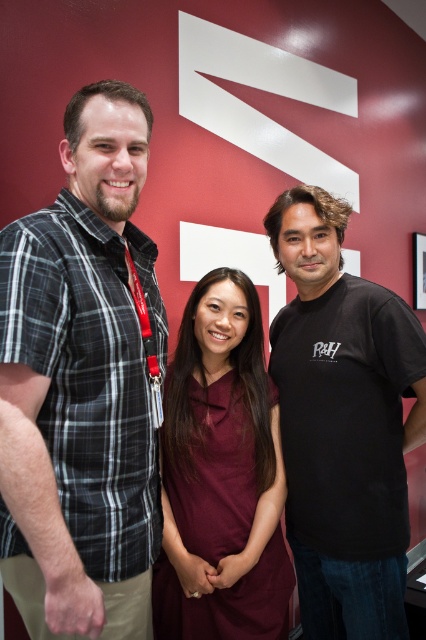
Question: Does black matte t-shirt at center appear on the left side of maroon fabric dress at center?

Choices:
 (A) no
 (B) yes

Answer: (A)

Question: Which of the following is the farthest from the observer?

Choices:
 (A) (282, 342)
 (B) (95, 260)

Answer: (A)

Question: Which of the following is the closest to the observer?

Choices:
 (A) maroon fabric dress at center
 (B) plaid shirt at left

Answer: (B)

Question: Which object appears closest to the camera in this image?

Choices:
 (A) plaid shirt at left
 (B) black matte t-shirt at center
 (C) maroon fabric dress at center

Answer: (A)

Question: Observing the image, what is the correct spatial positioning of black matte t-shirt at center in reference to maroon fabric dress at center?

Choices:
 (A) right
 (B) left

Answer: (A)

Question: Is plaid shirt at left to the right of maroon fabric dress at center from the viewer's perspective?

Choices:
 (A) yes
 (B) no

Answer: (B)